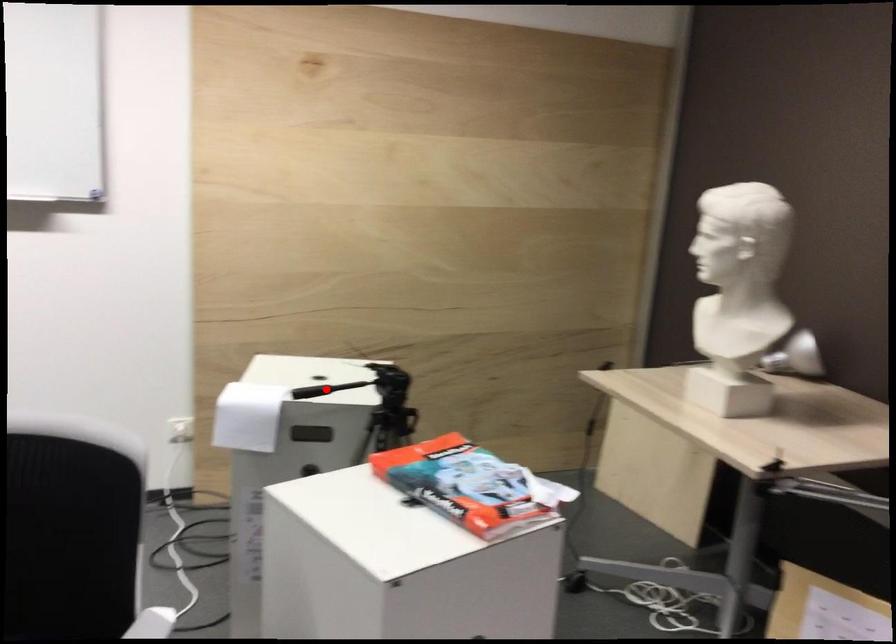
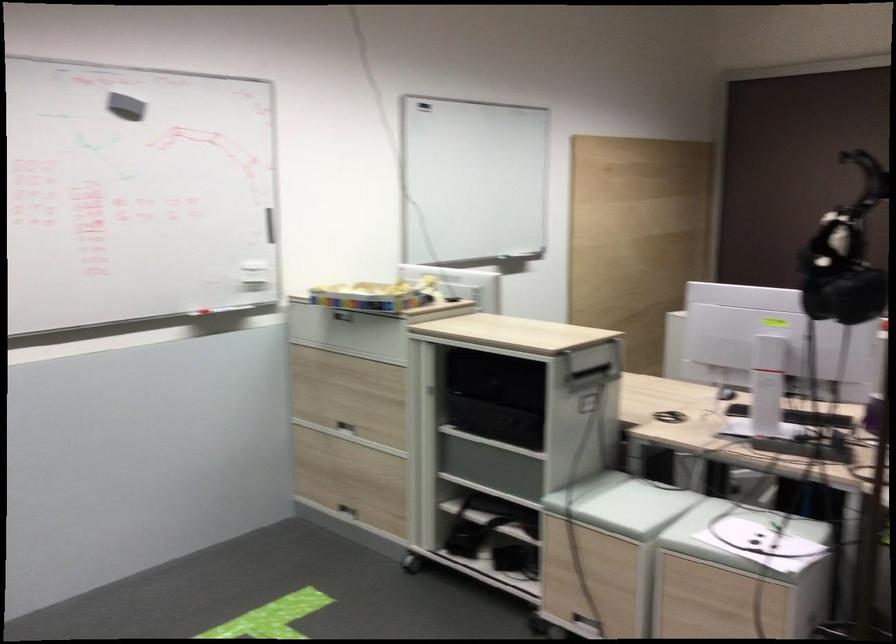
Question: I am providing you with two images of the same scene from different viewpoints. A red point is marked on the first image. Is the red point's position out of view in image 2?

Choices:
 (A) Yes
 (B) No

Answer: (A)